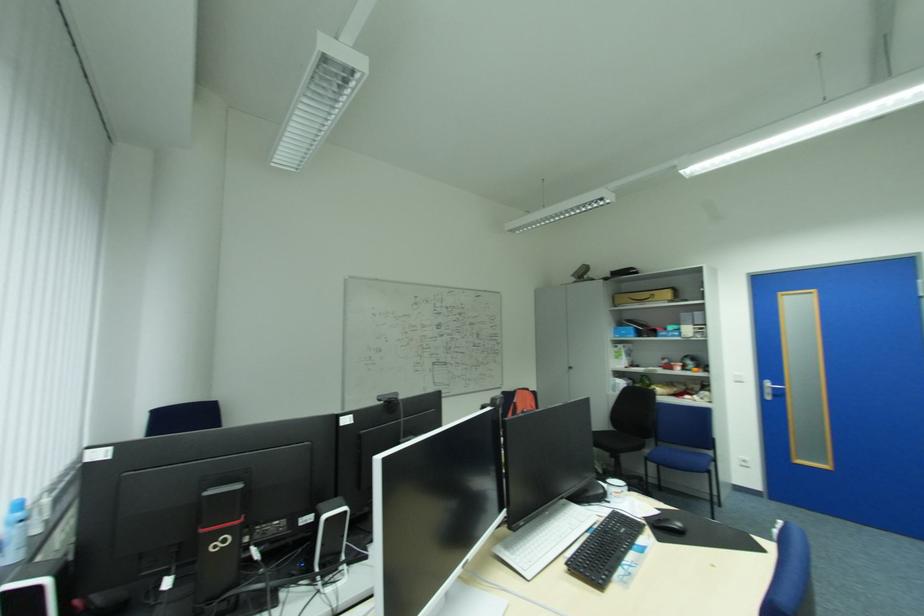
The location [643,296] corresponds to which object?

It refers to a cardboard box.